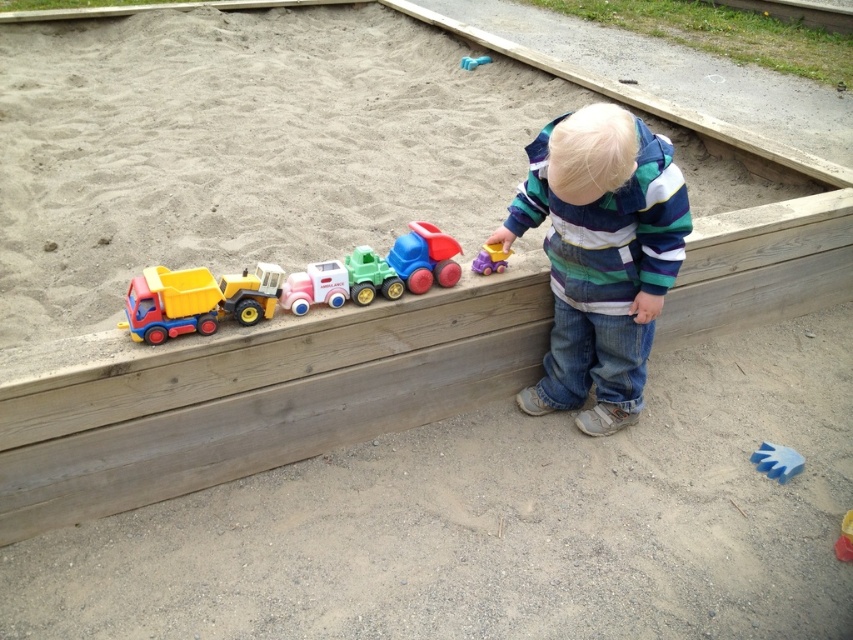
You are a parent supervising children at a playground. You notice the pastel plastic car at center and the blue rubber glove at lower right. Which object is closer to you?

The pastel plastic car at center is closer to you because it is in front of the blue rubber glove at lower right.